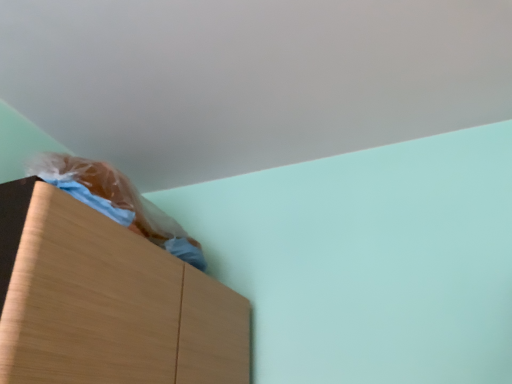
What do you see at coordinates (116, 201) in the screenshot?
I see `brown plastic bag at upper left` at bounding box center [116, 201].

At what (x,y) coordinates should I click in order to perform the action: click on brown plastic bag at upper left. Please return your answer as a coordinate pair (x, y). Looking at the image, I should click on (116, 201).

Find the location of a particular element. The image size is (512, 384). brown plastic bag at upper left is located at coordinates (116, 201).